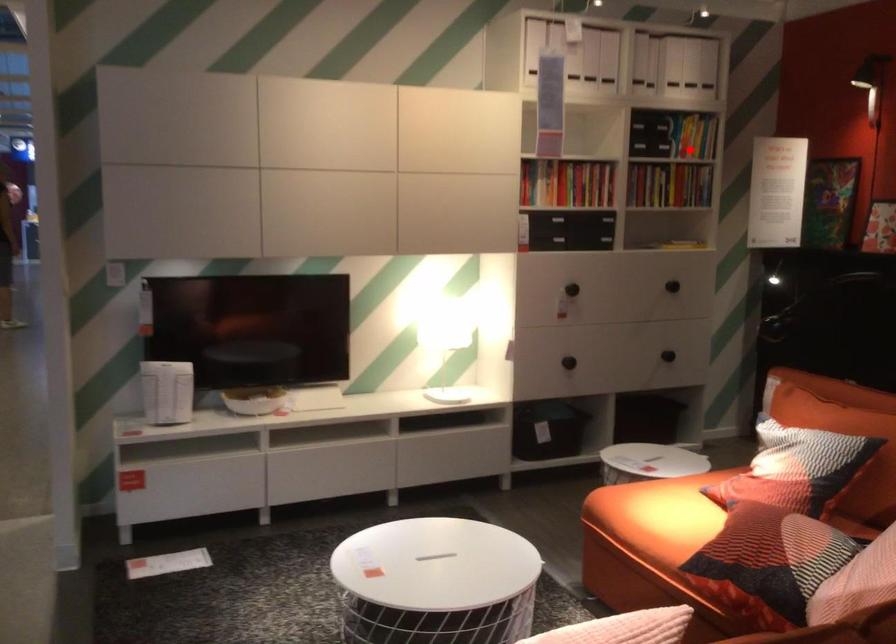
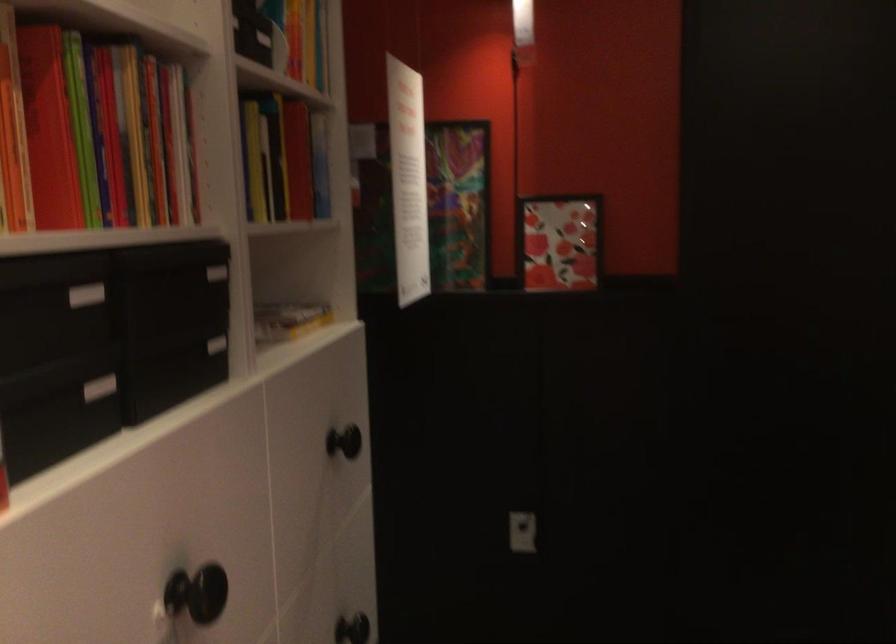
Question: I am providing you with two images of the same scene from different viewpoints. A red point is shown in image1. For the corresponding object point in image2, is it positioned nearer or farther from the camera?

Choices:
 (A) Nearer
 (B) Farther

Answer: (A)